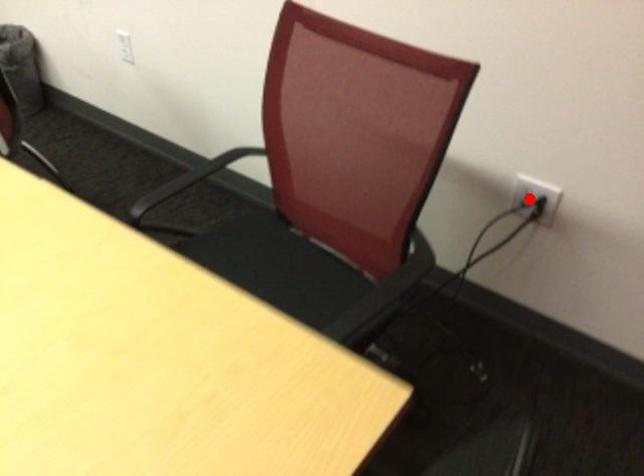
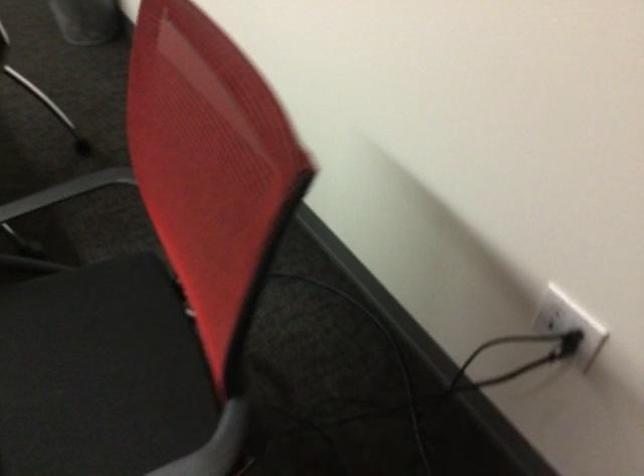
Question: I am providing you with two images of the same scene from different viewpoints. Given a red point in image1, look at the same physical point in image2. Is it:

Choices:
 (A) Closer to the viewpoint
 (B) Farther from the viewpoint

Answer: (A)